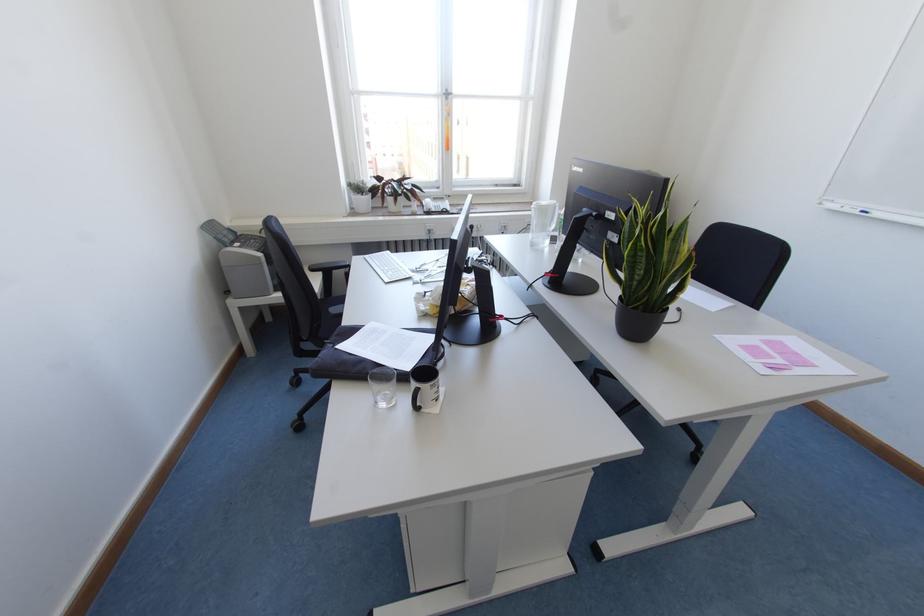
The height and width of the screenshot is (616, 924). I want to click on small white pot, so click(x=360, y=203).